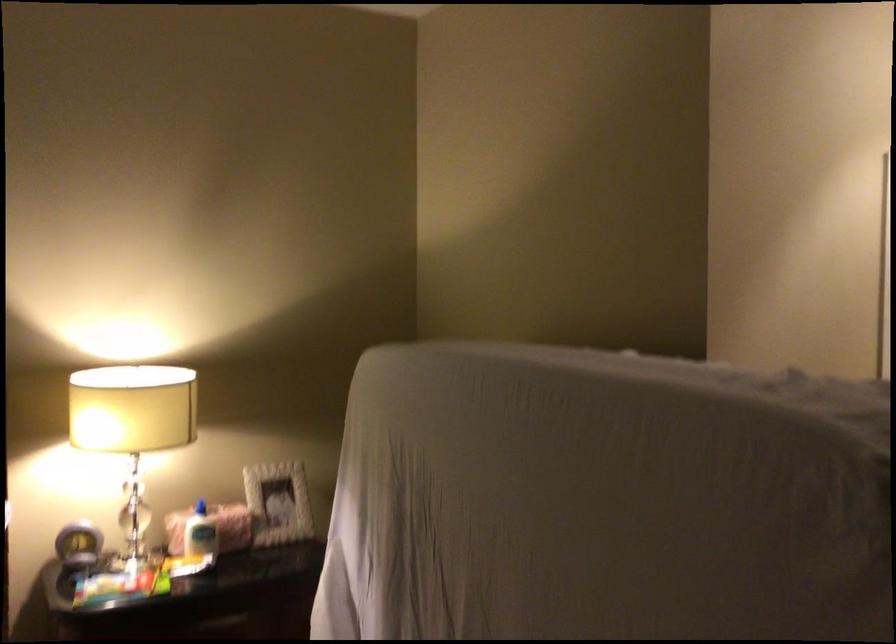
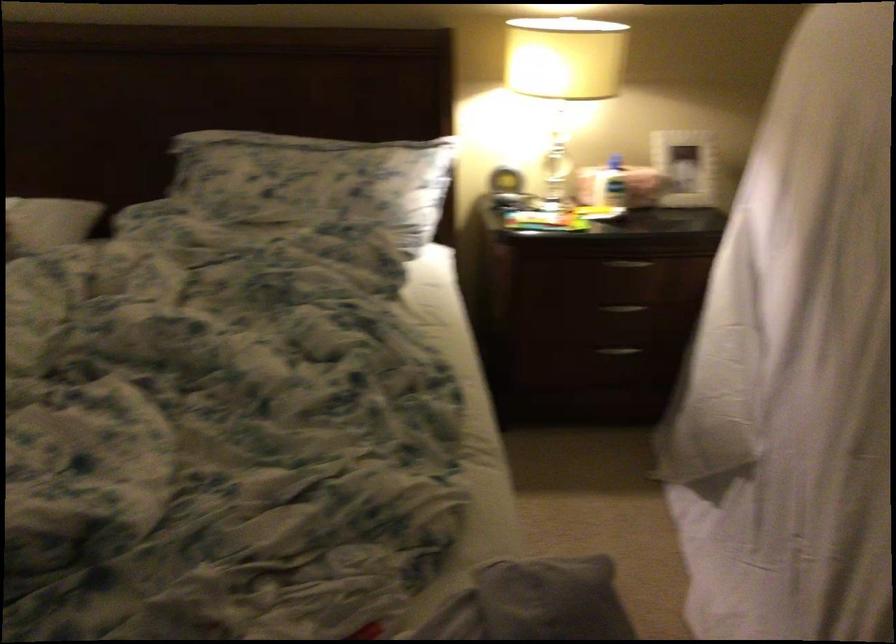
Where in the second image is the point corresponding to point 195,538 from the first image?

(609, 184)